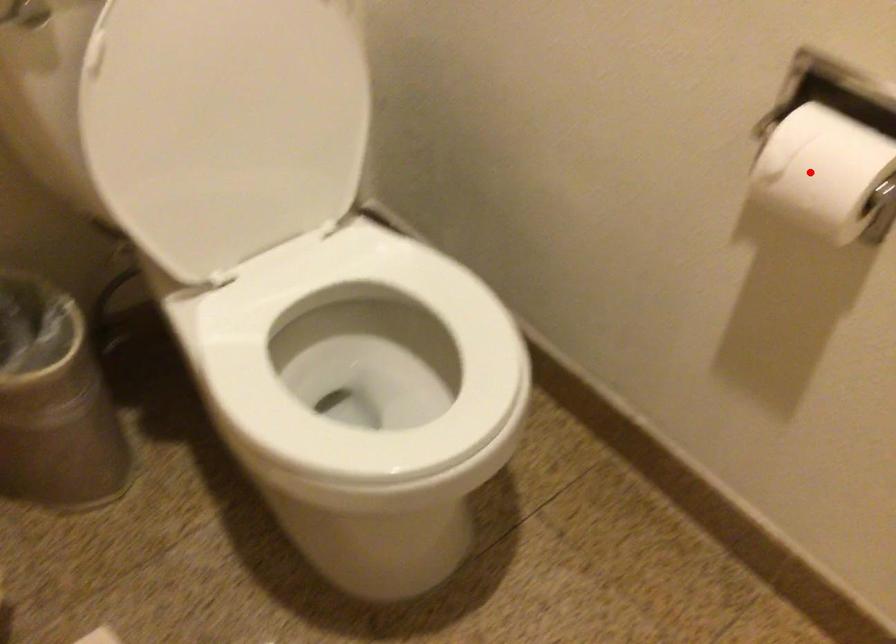
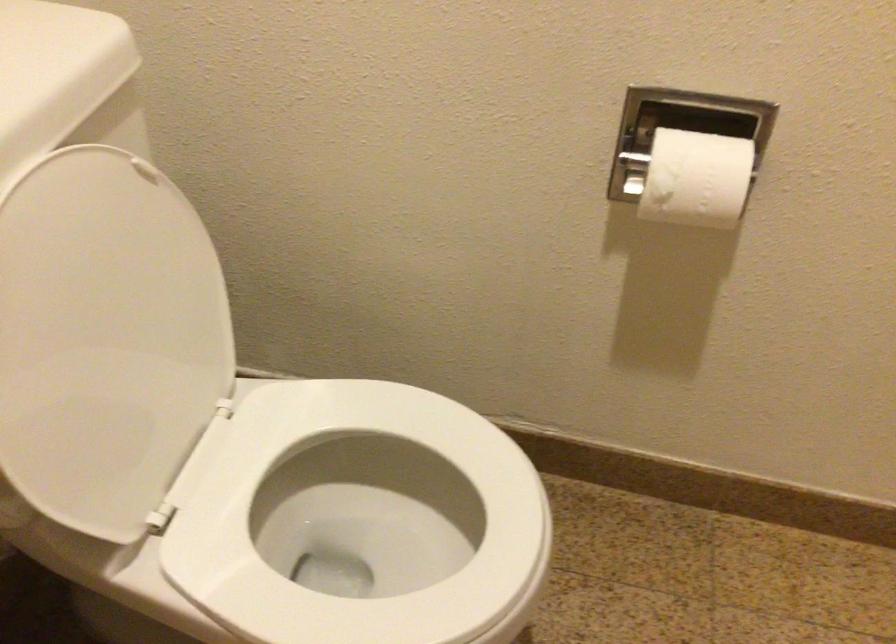
Question: I am providing you with two images of the same scene from different viewpoints. In image1, a red point is highlighted. Considering the same 3D point in image2, which of the following is correct?

Choices:
 (A) It is closer
 (B) It is farther

Answer: (B)